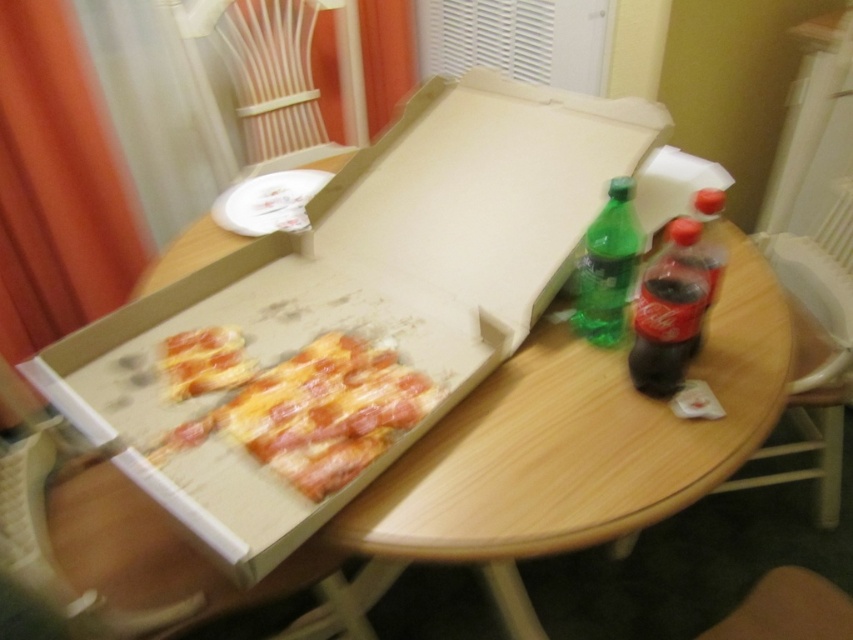
Can you confirm if cardboard box at center is positioned below cheesy pepperoni pizza at center?

Actually, cardboard box at center is above cheesy pepperoni pizza at center.

Which of these two, cardboard box at center or cheesy pepperoni pizza at center, stands taller?

cardboard box at center

Between point (468, 289) and point (224, 353), which one is positioned behind?

Point (468, 289)

Locate an element on the screen. cardboard box at center is located at coordinates pyautogui.click(x=364, y=289).

Can you confirm if cardboard box at center is thinner than translucent plastic soda bottle at right?

Incorrect, cardboard box at center's width is not less than translucent plastic soda bottle at right's.

Does point (498, 321) come in front of point (680, 349)?

No, (498, 321) is behind (680, 349).

Find the location of a particular element. The height and width of the screenshot is (640, 853). cardboard box at center is located at coordinates (364, 289).

Who is higher up, wooden at center or cheesy pepperoni pizza at center?

cheesy pepperoni pizza at center is higher up.

Identify the location of wooden at center. tap(576, 448).